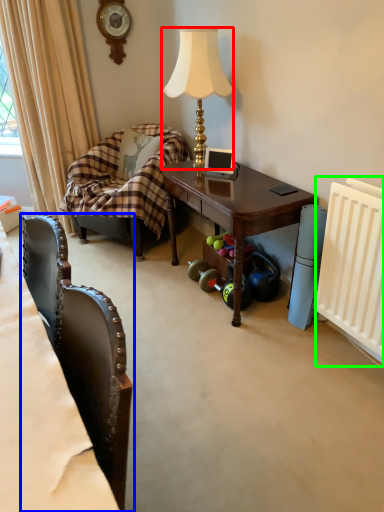
Question: Based on their relative distances, which object is nearer to lamp (highlighted by a red box)? Choose from chair (highlighted by a blue box) and radiator (highlighted by a green box).

Choices:
 (A) chair
 (B) radiator

Answer: (B)